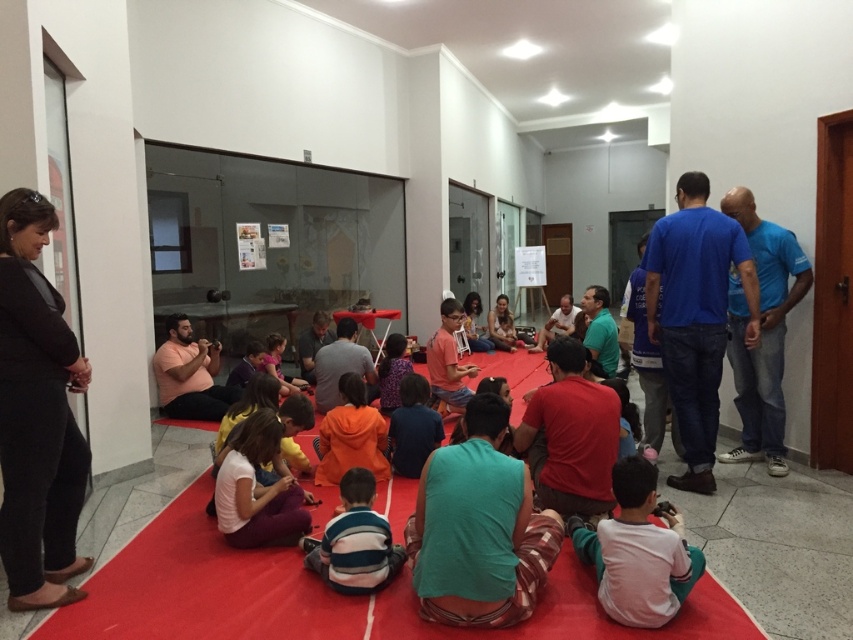
Can you confirm if blue cotton shirt at right is positioned above dark blue shirt at center?

Yes, blue cotton shirt at right is above dark blue shirt at center.

Is point (712, 424) in front of point (393, 460)?

That is True.

Where is `blue cotton shirt at right`? This screenshot has height=640, width=853. blue cotton shirt at right is located at coordinates (695, 316).

Locate an element on the screen. The height and width of the screenshot is (640, 853). striped cotton shirt at center is located at coordinates point(355,541).

Does striped cotton shirt at center appear under orange fleece jacket at center?

Yes.

Between point (329, 552) and point (317, 472), which one is positioned behind?

Positioned behind is point (317, 472).

Find the location of a particular element. Image resolution: width=853 pixels, height=640 pixels. striped cotton shirt at center is located at coordinates (355, 541).

Can you confirm if blue cotton shirt at right is positioned to the left of blue t-shirt at right?

Indeed, blue cotton shirt at right is positioned on the left side of blue t-shirt at right.

Between blue cotton shirt at right and blue t-shirt at right, which one has more height?

With more height is blue cotton shirt at right.

What do you see at coordinates (695, 316) in the screenshot?
I see `blue cotton shirt at right` at bounding box center [695, 316].

You are a GUI agent. You are given a task and a screenshot of the screen. Output one action in this format:
    pyautogui.click(x=<x>, y=<y>)
    Task: Click on the blue cotton shirt at right
    The width and height of the screenshot is (853, 640).
    Given the screenshot: What is the action you would take?
    pyautogui.click(x=695, y=316)